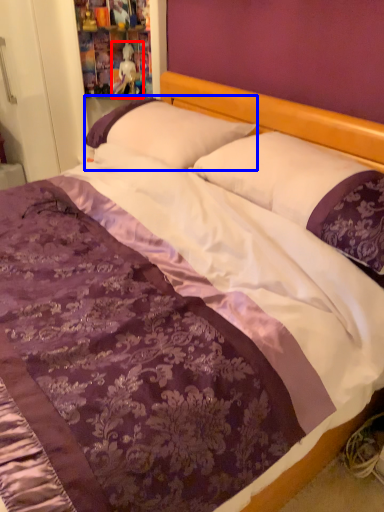
Question: Which object appears farthest to the camera in this image, doll (highlighted by a red box) or pillow (highlighted by a blue box)?

Choices:
 (A) doll
 (B) pillow

Answer: (A)